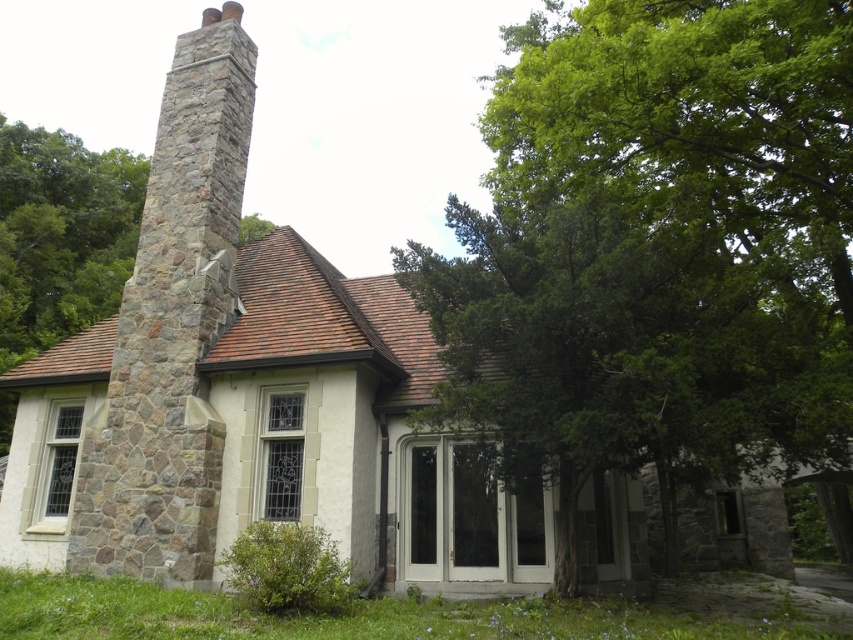
Looking at this image, you are a landscape architect planning to plant a new tree in the front yard of the house. The existing green leafy tree at center and the stone chimney at left are 29.89 feet apart. If the new tree you want to plant has a mature spread of 15 feet, will there be enough space between the new tree and the stone chimney to avoid root interference?

The green leafy tree at center and the stone chimney at left are 29.89 feet apart. Since the new tree has a mature spread of 15 feet, the minimum recommended distance from the stone chimney should be at least half the tree spread, which is 7.5 feet. The existing distance of 29.89 feet is more than sufficient to accommodate the new tree without root interference.

You are a window cleaner standing at the front of the house. You need to clean the French doors with large glass panes and also the windows near the stone chimney at left. Considering the height of the green leafy tree at center, do you think you can safely use your ladder without the branches obstructing your work?

The green leafy tree at center is much taller than the stone chimney at left, so its branches may obstruct the ladder when cleaning the windows near the stone chimney at left. You should check the branches before using the ladder to ensure safety.

You are standing in front of the house and want to plant a new tree in the exact center of the yard. The current green leafy tree at center is located at coordinates point 0.391, 0.768. Is the existing tree already positioned at the center of the yard?

The green leafy tree at center is located at point (654, 250), which indicates its position relative to the yard. Since the question asks if it is at the exact center, the coordinates provided do not match the center point of the yard. The exact center would typically be at coordinates like (426, 320). Therefore, the existing tree is not positioned at the center of the yard.